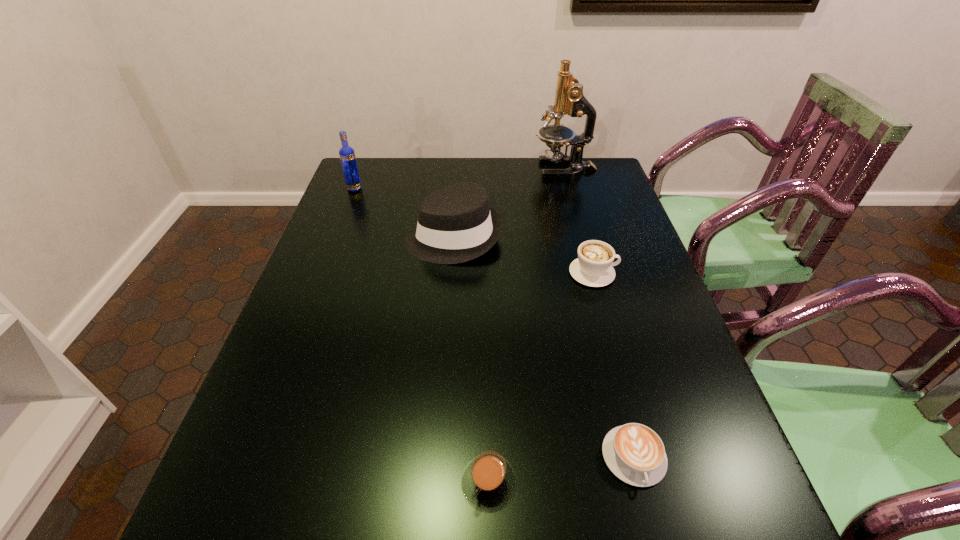
The height and width of the screenshot is (540, 960). In order to click on free spot between the shortest cappuccino and the fedora in this screenshot , I will do `click(544, 347)`.

This screenshot has height=540, width=960. Find the location of `vacant area that lies between the farthest cappuccino and the shortest cappuccino`. vacant area that lies between the farthest cappuccino and the shortest cappuccino is located at coordinates (613, 365).

Where is `vacant space in between the shortest cappuccino and the tallest cappuccino`? vacant space in between the shortest cappuccino and the tallest cappuccino is located at coordinates click(613, 365).

You are a GUI agent. You are given a task and a screenshot of the screen. Output one action in this format:
    pyautogui.click(x=<x>, y=<y>)
    Task: Click on the free spot between the fifth nearest object and the microscope
    Image resolution: width=960 pixels, height=540 pixels.
    Given the screenshot: What is the action you would take?
    pos(460,179)

Locate an element on the screen. This screenshot has width=960, height=540. unoccupied area between the second shortest cappuccino and the tallest cappuccino is located at coordinates (540, 377).

Locate an element on the screen. free space between the third tallest object and the shortest object is located at coordinates (544, 347).

Identify the location of vacant space in between the microscope and the fedora. The height and width of the screenshot is (540, 960). 509,203.

Identify the location of object that is the second closest to the shortest cappuccino. (593, 267).

At what (x,y) coordinates should I click in order to perform the action: click on object that is the third closest one to the second farthest object. Please return your answer as a coordinate pair (x, y). Image resolution: width=960 pixels, height=540 pixels. Looking at the image, I should click on (593, 267).

Locate which cappuccino ranks in proximity to the leftmost object. Please provide its 2D coordinates. Your answer should be formatted as a tuple, i.e. [(x, y)], where the tuple contains the x and y coordinates of a point satisfying the conditions above.

[(593, 267)]